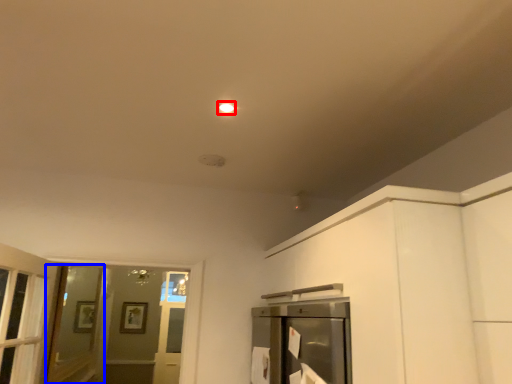
Question: Which point is closer to the camera, lighting (highlighted by a red box) or screen door (highlighted by a blue box)?

Choices:
 (A) lighting
 (B) screen door

Answer: (A)